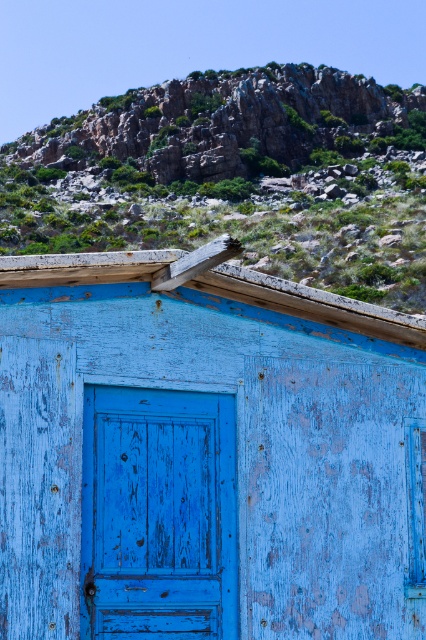
Question: Which of the following is the farthest from the observer?

Choices:
 (A) rusty wood hut at center
 (B) blue wooden door at center
 (C) rusty rock at upper center

Answer: (C)

Question: Is rusty wood hut at center positioned in front of blue wooden door at center?

Choices:
 (A) yes
 (B) no

Answer: (A)

Question: Which object appears farthest from the camera in this image?

Choices:
 (A) rusty rock at upper center
 (B) rusty wood hut at center
 (C) blue wooden door at center

Answer: (A)

Question: Considering the real-world distances, which object is farthest from the blue wooden door at center?

Choices:
 (A) rusty wood hut at center
 (B) rusty rock at upper center

Answer: (B)

Question: Is rusty wood hut at center to the left of blue wooden door at center from the viewer's perspective?

Choices:
 (A) yes
 (B) no

Answer: (B)

Question: Where is rusty wood hut at center located in relation to blue wooden door at center in the image?

Choices:
 (A) below
 (B) above

Answer: (B)